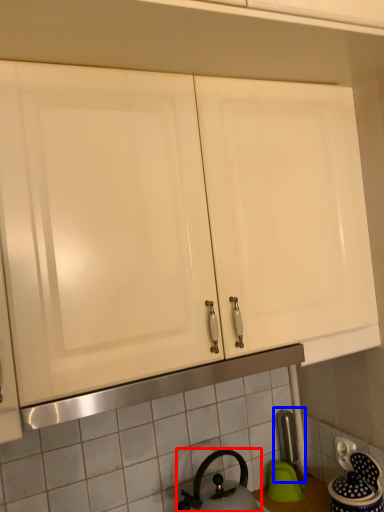
Question: Which object is further to the camera taking this photo, kettle (highlighted by a red box) or faucet (highlighted by a blue box)?

Choices:
 (A) kettle
 (B) faucet

Answer: (B)